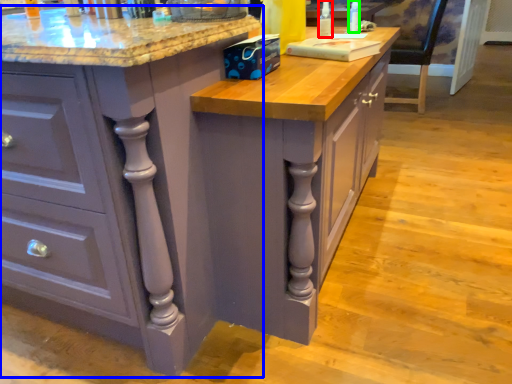
Question: Which object is the closest to the bottle (highlighted by a red box)? Choose among these: cabinetry (highlighted by a blue box) or bottle (highlighted by a green box).

Choices:
 (A) cabinetry
 (B) bottle

Answer: (B)